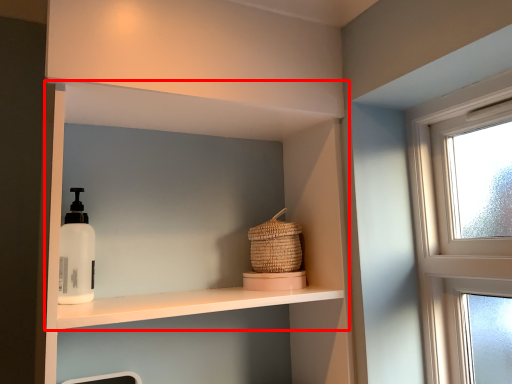
Question: Observing the image, what is the correct spatial positioning of shelf (annotated by the red box) in reference to basket?

Choices:
 (A) left
 (B) right

Answer: (A)